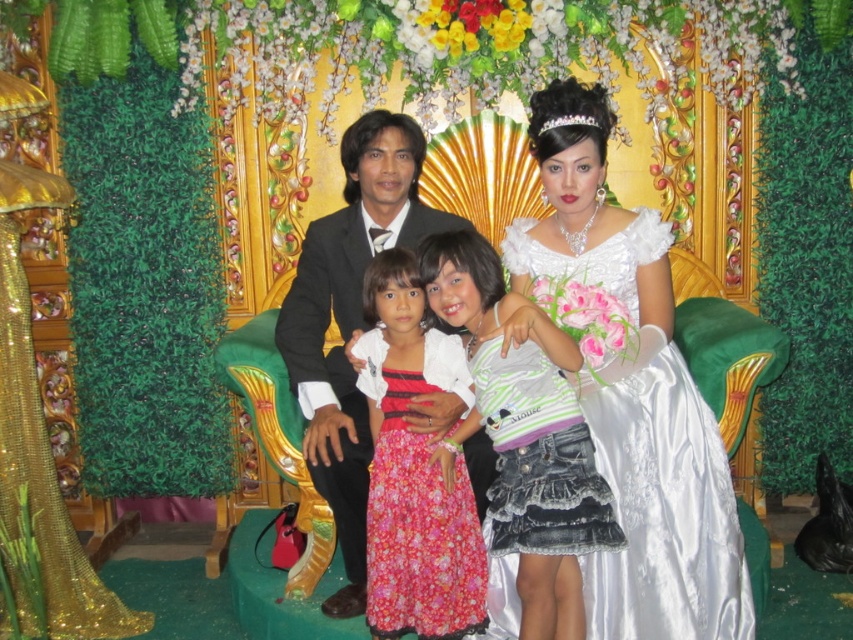
You are a photographer setting up for a family photo. You need to ensure that the white satin dress at center and the striped jersey at center are both visible in the frame. Based on their positions, which one is closer to the camera?

The white satin dress at center is above the striped jersey at center, so it is closer to the camera.

You are a photographer setting up for a family photo. You have two main subjects wearing the white satin dress at center and the shiny black suit at center. The backdrop has limited space. Which clothing item takes up more space and might require adjusting the backdrop?

The white satin dress at center is larger in size than the shiny black suit at center, so it takes up more space and may require adjusting the backdrop.

You are a photographer at the event and need to adjust the lighting to ensure both the floral cotton dress at center and the denim skirt at center are well lit. Which one is positioned further back and might need more light adjustment?

The denim skirt at center is behind the floral cotton dress at center, so it is positioned further back and might need more light adjustment.